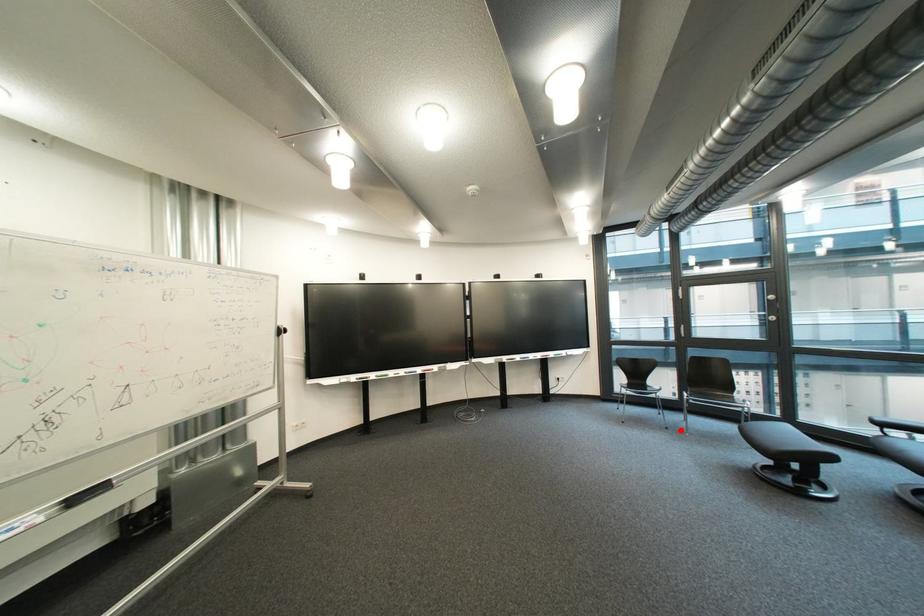
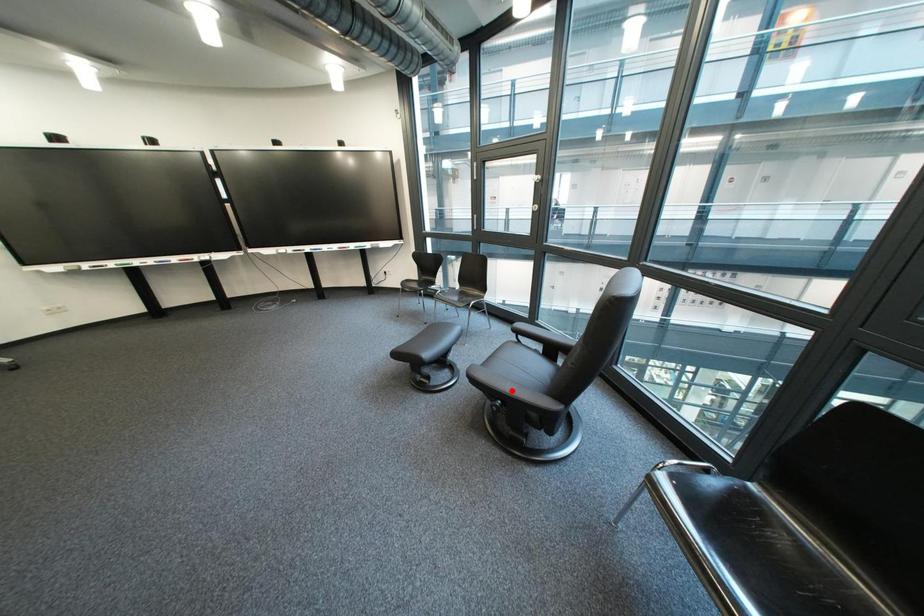
I am providing you with two images of the same scene from different viewpoints. A red point is marked on the first image and another point is marked on the second image. Is the red point in image1 aligned with the point shown in image2?

No